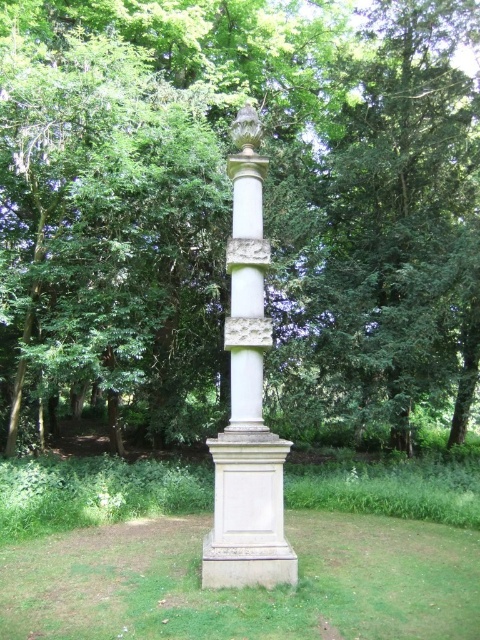
You are standing at the origin point in the image. Where is the green leafy tree at center located in terms of coordinates?

The green leafy tree at center is located at coordinates point (229,211).

You are standing in the outdoor area looking at the scene. There is a green leafy tree at center and a white stone column at center. Which object is positioned to the right side?

The green leafy tree at center is positioned to the right of the white stone column at center.